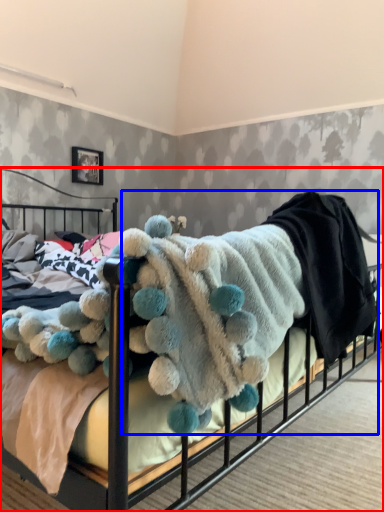
Question: Which of the following is the closest to the observer, bed (highlighted by a red box) or baby clothe (highlighted by a blue box)?

Choices:
 (A) bed
 (B) baby clothe

Answer: (A)